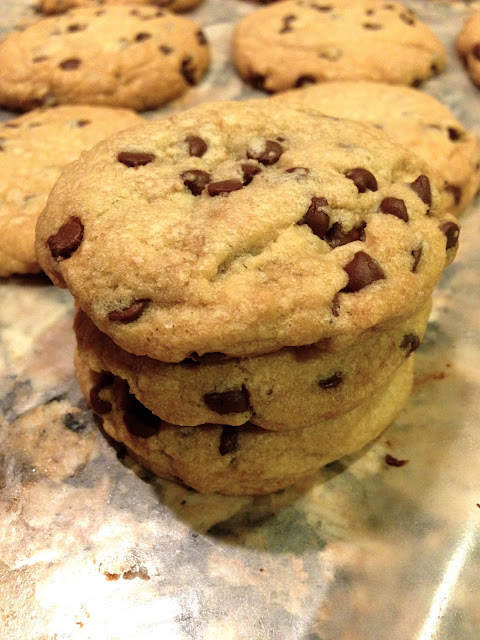
I want to click on shiny spots on counter, so click(x=443, y=593), click(x=320, y=591), click(x=148, y=612).